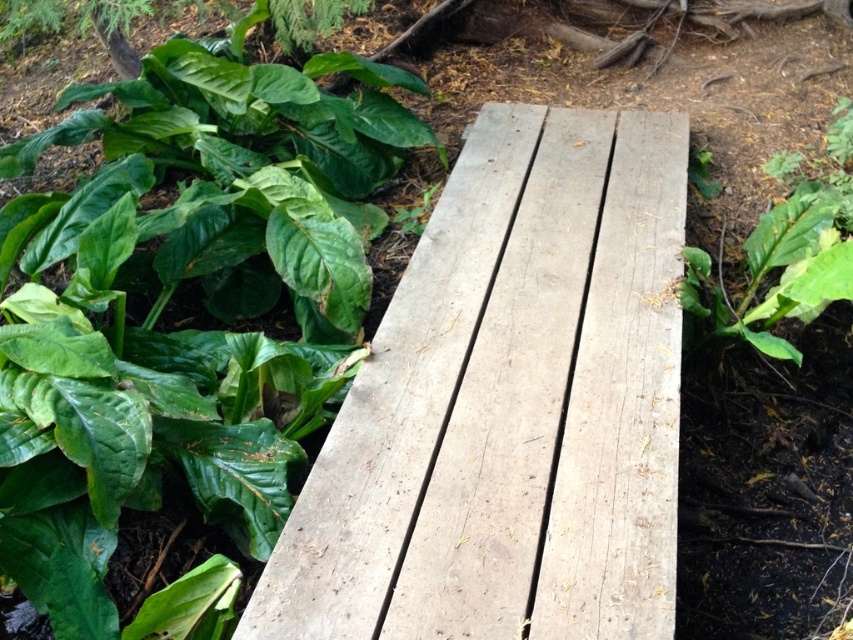
Between weathered wood plank at center and green leafy plant at right, which one appears on the right side from the viewer's perspective?

green leafy plant at right

Which is above, weathered wood plank at center or green leafy plant at right?

Positioned higher is green leafy plant at right.

The height and width of the screenshot is (640, 853). In order to click on weathered wood plank at center in this screenshot , I will do `click(622, 406)`.

Where is `weathered wood plank at center`? This screenshot has width=853, height=640. weathered wood plank at center is located at coordinates (622, 406).

At what (x,y) coordinates should I click in order to perform the action: click on green matte leafy plant at upper left. Please return your answer as a coordinate pair (x, y). The height and width of the screenshot is (640, 853). Looking at the image, I should click on (171, 296).

In the scene shown: Who is more distant from viewer, (218,144) or (614,573)?

Point (218,144)

I want to click on green matte leafy plant at upper left, so click(x=171, y=296).

Between weathered wood bench at center and green matte leafy plant at upper left, which one has more height?

With more height is green matte leafy plant at upper left.

Can you confirm if weathered wood bench at center is positioned to the right of green matte leafy plant at upper left?

Indeed, weathered wood bench at center is positioned on the right side of green matte leafy plant at upper left.

Locate an element on the screen. The width and height of the screenshot is (853, 640). weathered wood bench at center is located at coordinates (509, 404).

The height and width of the screenshot is (640, 853). I want to click on weathered wood bench at center, so click(509, 404).